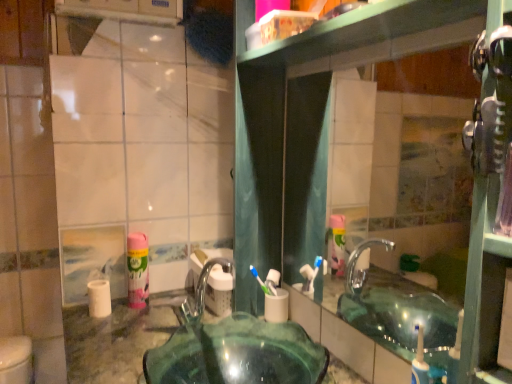
Identify the location of free location to the right of white matte toilet paper at left, which ranks as the 1th toilet paper in left-to-right order. The height and width of the screenshot is (384, 512). (141, 317).